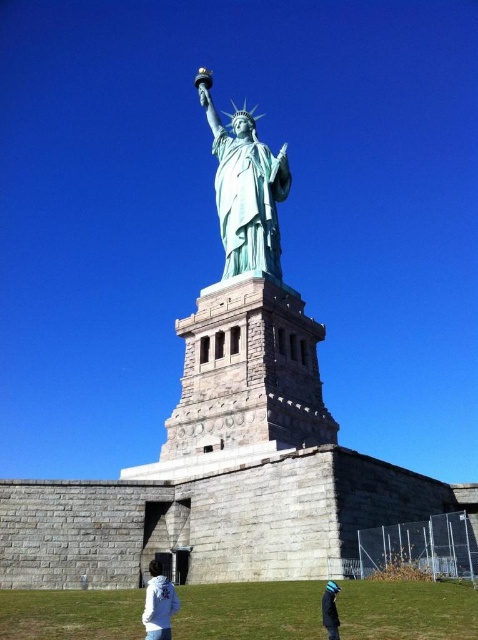
Question: Which object appears closest to the camera in this image?

Choices:
 (A) green patina statue at center
 (B) white fleece jacket at lower center
 (C) blue knit cap at lower center

Answer: (C)

Question: Which is nearer to the white fleece jacket at lower center?

Choices:
 (A) blue knit cap at lower center
 (B) green patina statue at center

Answer: (A)

Question: Is white fleece jacket at lower center in front of blue knit cap at lower center?

Choices:
 (A) no
 (B) yes

Answer: (A)

Question: Based on their relative distances, which object is farther from the blue knit cap at lower center?

Choices:
 (A) green patina statue at center
 (B) white fleece jacket at lower center

Answer: (A)

Question: Can you confirm if green patina statue at center is positioned below blue knit cap at lower center?

Choices:
 (A) yes
 (B) no

Answer: (B)

Question: Is the position of green patina statue at center less distant than that of white fleece jacket at lower center?

Choices:
 (A) yes
 (B) no

Answer: (B)